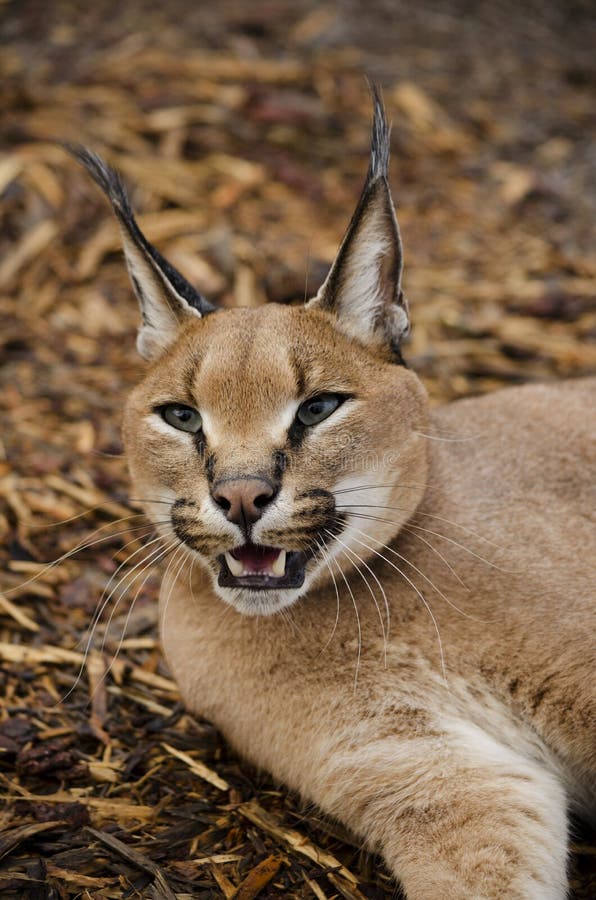
You are a GUI agent. You are given a task and a screenshot of the screen. Output one action in this format:
    pyautogui.click(x=<x>, y=<y>)
    Task: Click on the white fur
    
    Given the screenshot: What is the action you would take?
    pyautogui.click(x=369, y=499), pyautogui.click(x=163, y=518)